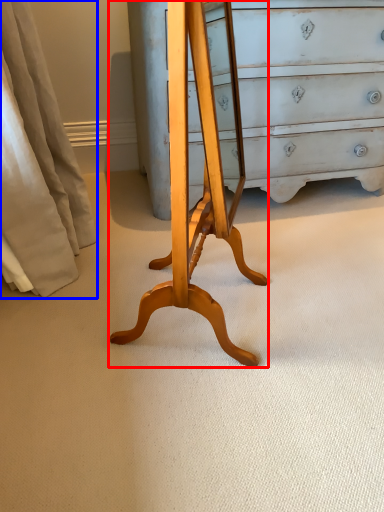
Question: Among these objects, which one is farthest to the camera, changing table (highlighted by a red box) or curtain (highlighted by a blue box)?

Choices:
 (A) changing table
 (B) curtain

Answer: (B)